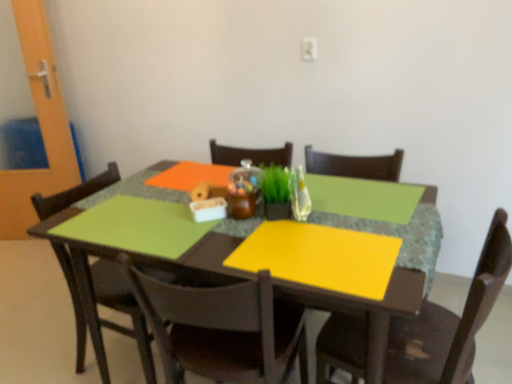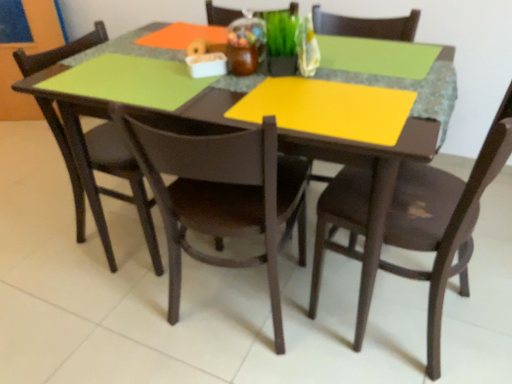
Question: Which way did the camera rotate in the video?

Choices:
 (A) rotated upward
 (B) rotated downward

Answer: (B)